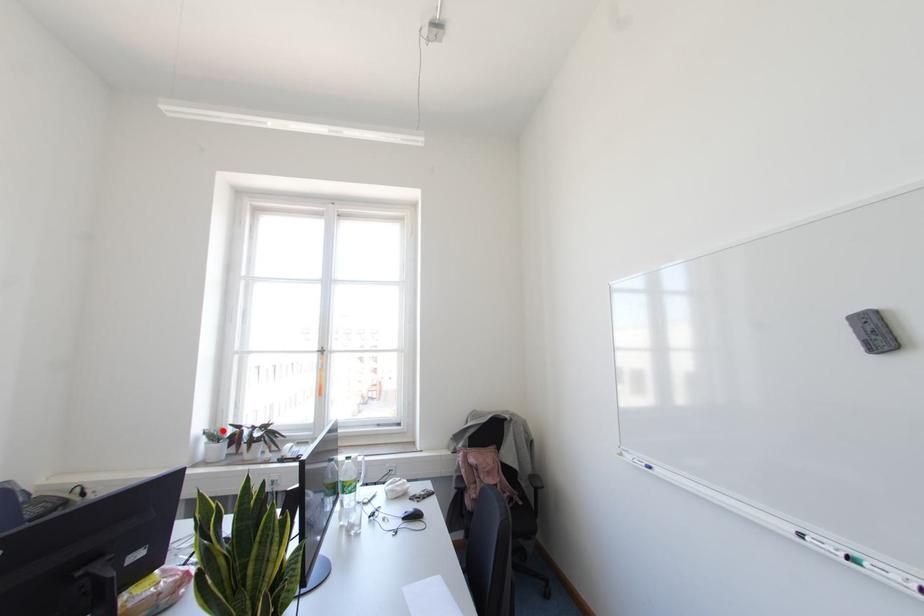
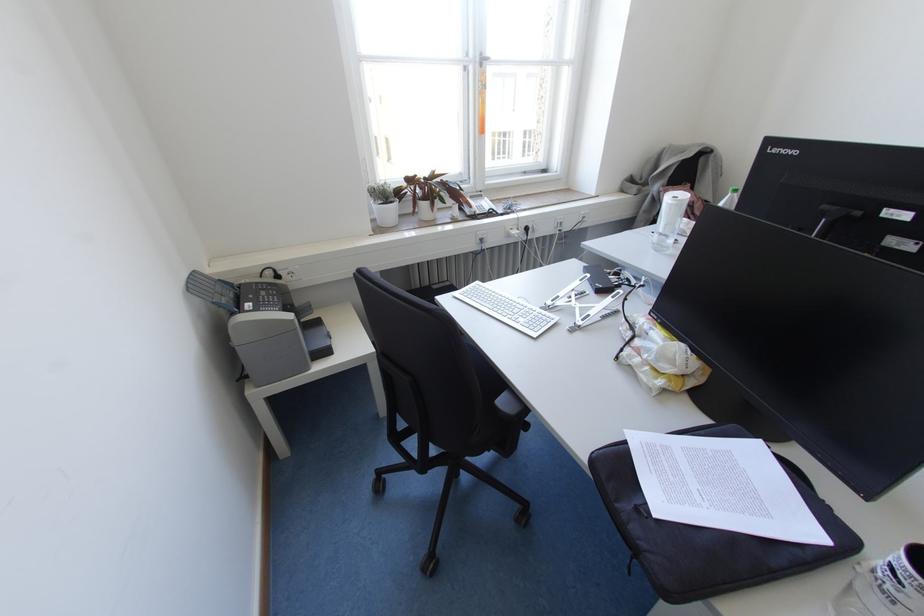
Question: A red point is marked in image1. In image2, is the corresponding 3D point closer to the camera or farther? Reply with the corresponding letter.

Choices:
 (A) The corresponding 3D point is closer.
 (B) The corresponding 3D point is farther.

Answer: (A)